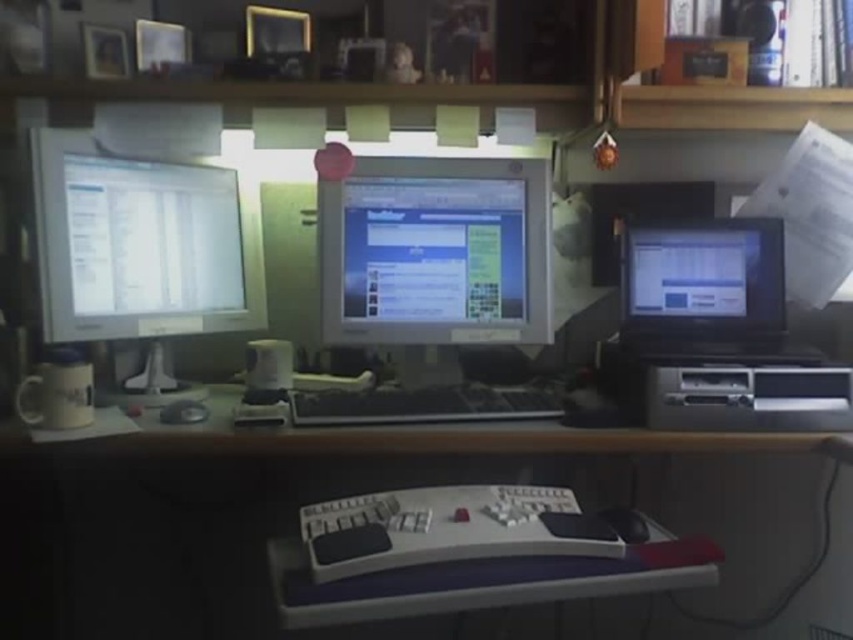
Question: Which of these objects is positioned closest to the matte silver monitor at left?

Choices:
 (A) wooden computer desk at center
 (B) black plastic keyboard at center

Answer: (B)

Question: Does matte silver monitor at left come behind matte black monitor at right?

Choices:
 (A) no
 (B) yes

Answer: (A)

Question: Can you confirm if matte silver monitor at left is smaller than satin silver printer at lower right?

Choices:
 (A) no
 (B) yes

Answer: (A)

Question: Which of the following is the closest to the observer?

Choices:
 (A) wooden computer desk at center
 (B) matte black monitor at right

Answer: (B)

Question: Is the position of matte black monitor at right less distant than that of black rubber mouse at lower center?

Choices:
 (A) yes
 (B) no

Answer: (B)

Question: Which point is farther to the camera?

Choices:
 (A) (433, 522)
 (B) (157, 292)
 (C) (618, 518)

Answer: (B)